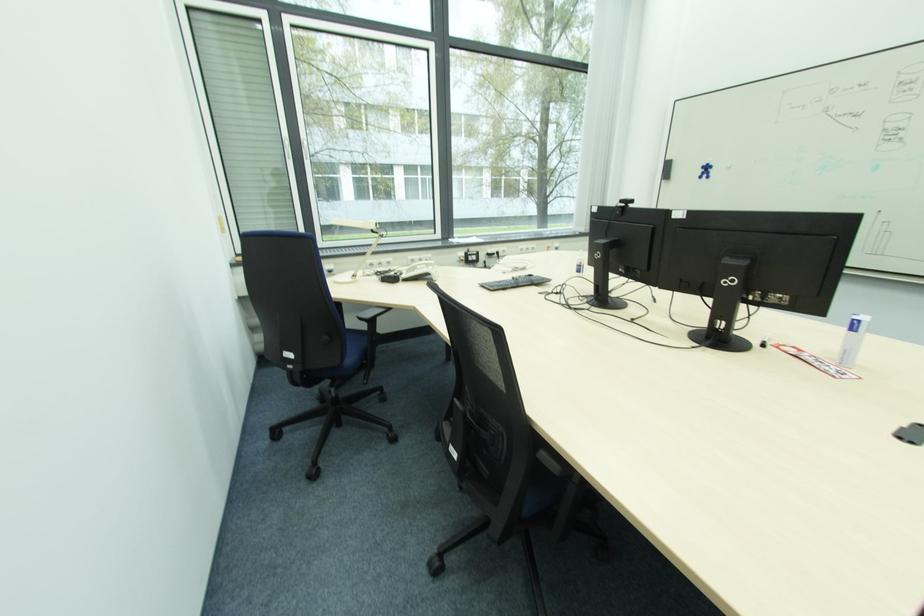
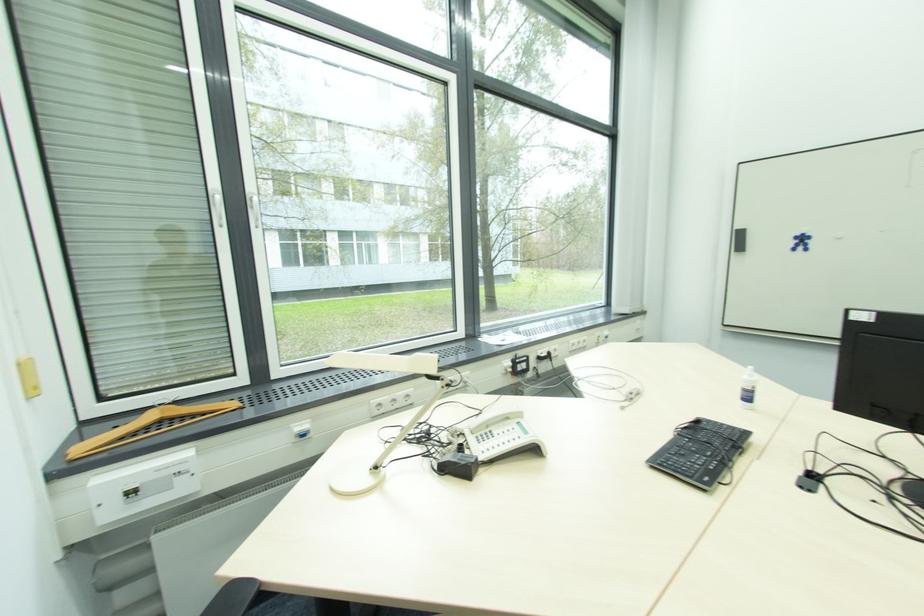
Locate, in the second image, the point that corresponds to point 671,161 in the first image.

(739, 230)